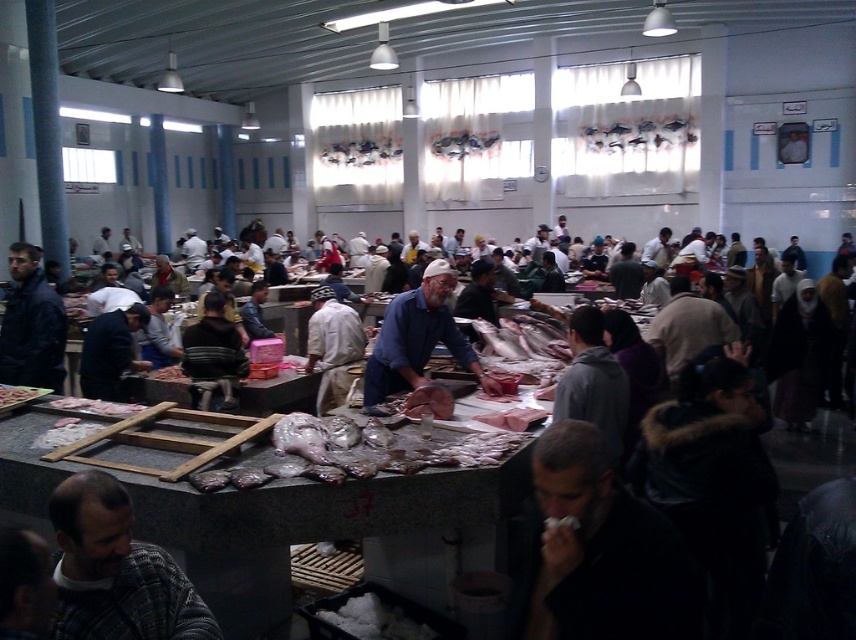
Does blue fabric at center have a greater width compared to white fabric at center?

Yes.

Based on the photo, which of these two, blue fabric at center or white fabric at center, stands taller?

With more height is white fabric at center.

Locate an element on the screen. blue fabric at center is located at coordinates (418, 339).

Locate an element on the screen. The height and width of the screenshot is (640, 856). blue fabric at center is located at coordinates (418, 339).

Is white fabric at center further to the viewer compared to shiny silver fish at center?

That is True.

Does white fabric at center have a greater width compared to shiny silver fish at center?

Indeed, white fabric at center has a greater width compared to shiny silver fish at center.

In order to click on white fabric at center in this screenshot , I will do `click(331, 346)`.

What do you see at coordinates (602, 550) in the screenshot? This screenshot has width=856, height=640. I see `dark matte jacket at lower right` at bounding box center [602, 550].

Is point (678, 564) behind point (22, 396)?

No, it is not.

The image size is (856, 640). In order to click on dark matte jacket at lower right in this screenshot , I will do [x=602, y=550].